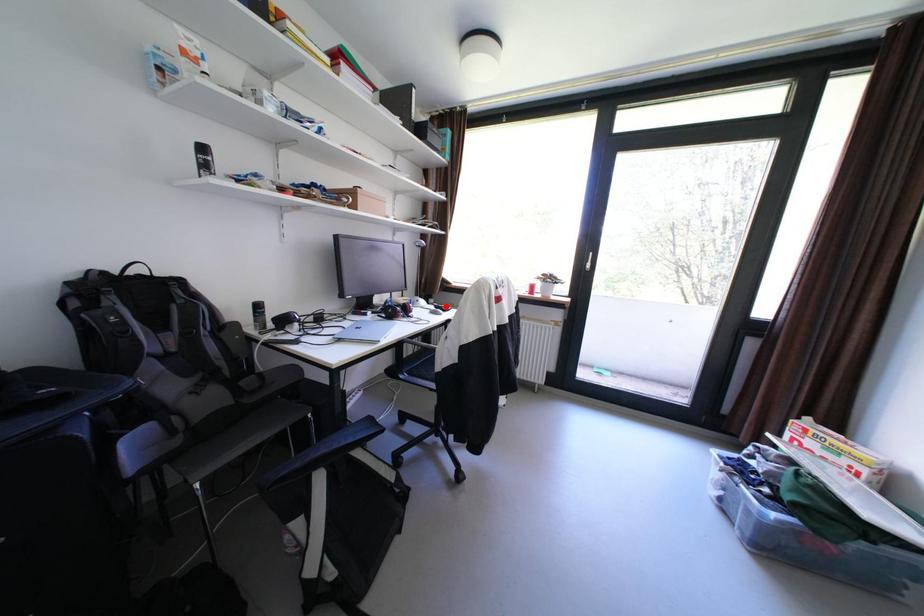
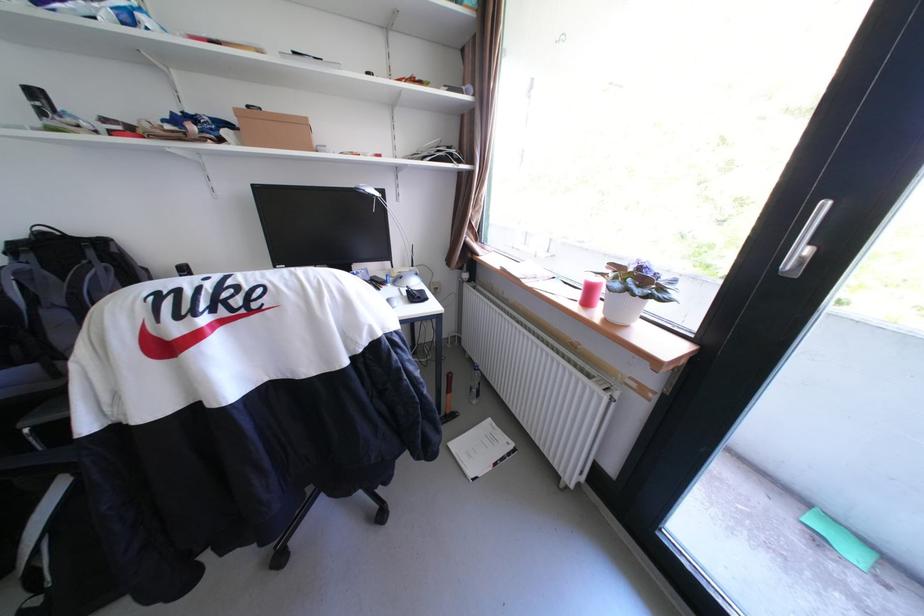
In the second image, find the point that corresponds to the highlighted location in the first image.

(418, 291)